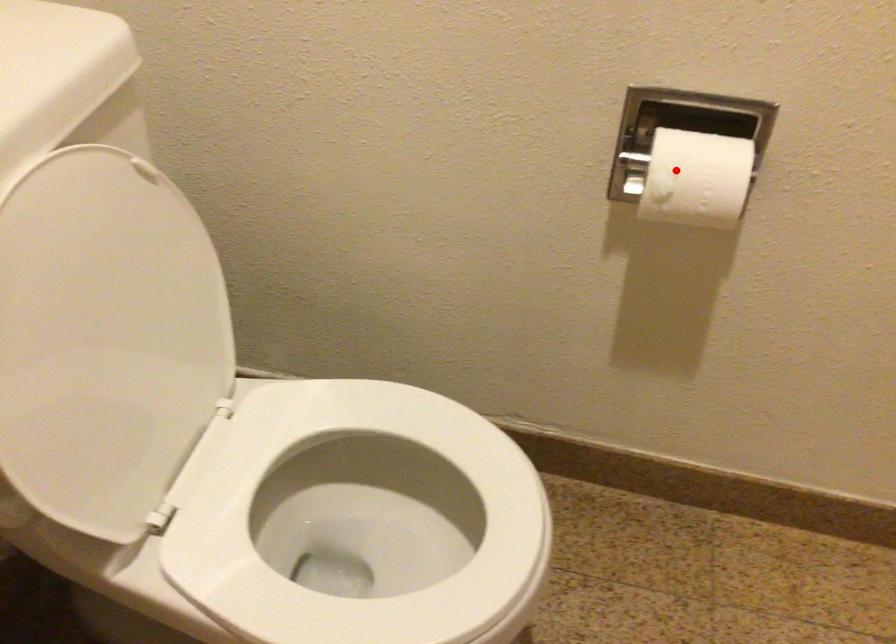
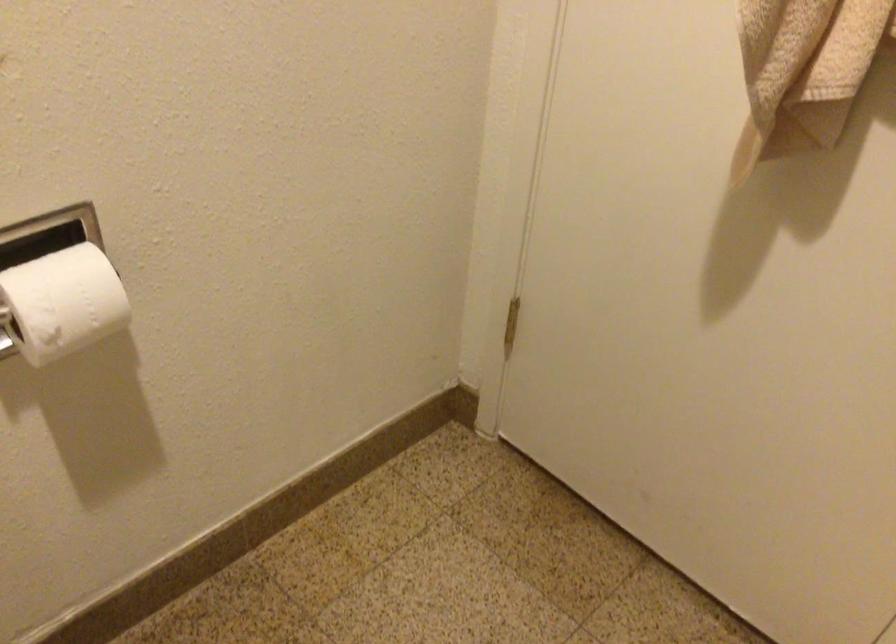
Locate, in the second image, the point that corresponds to the highlighted location in the first image.

(62, 303)